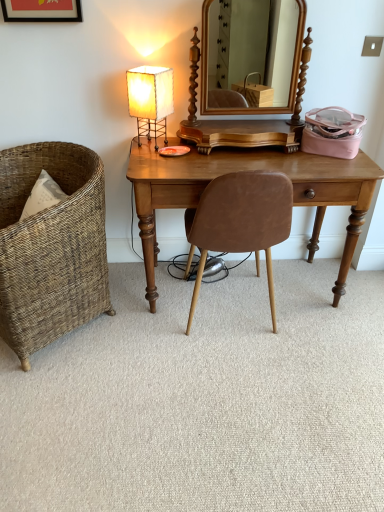
Where is `vacant location below brown leather chair at center, placed as the second chair when sorted from left to right (from a real-world perspective)`? The image size is (384, 512). vacant location below brown leather chair at center, placed as the second chair when sorted from left to right (from a real-world perspective) is located at coordinates (238, 325).